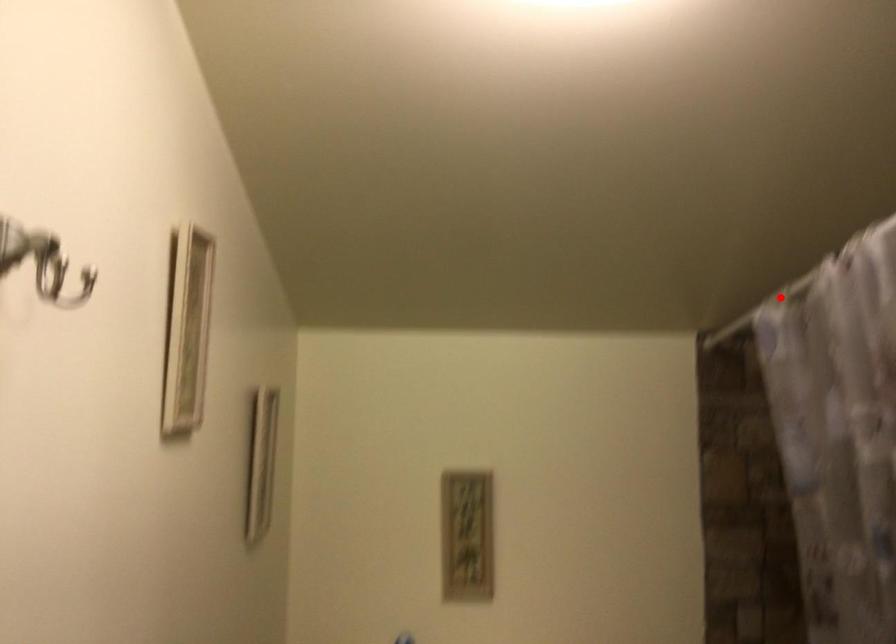
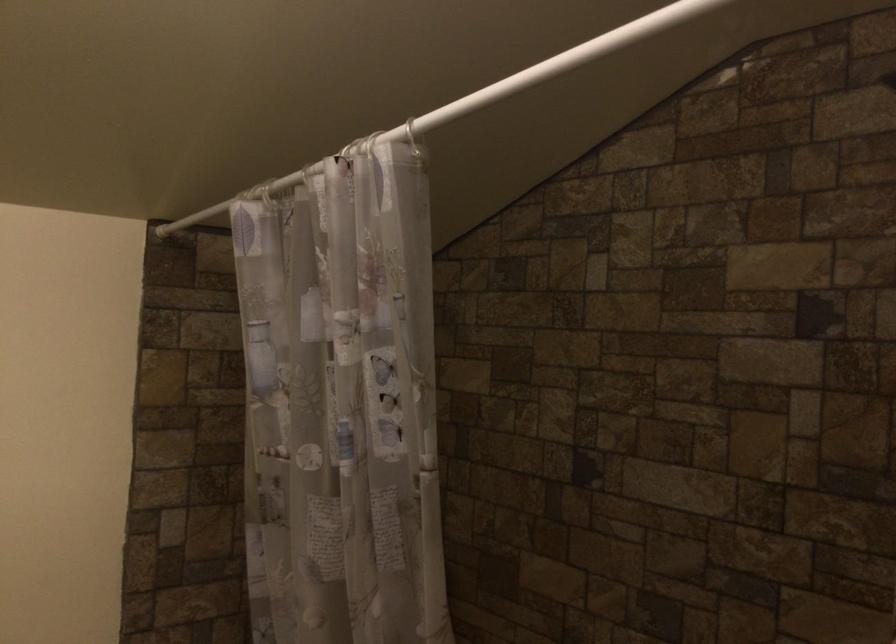
Locate, in the second image, the point that corresponds to the highlighted location in the first image.

(269, 194)